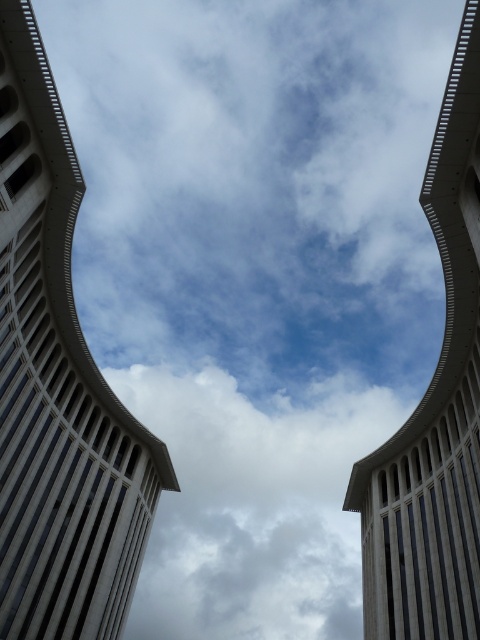
You are a drone operator tasked with flying a drone between the white fluffy cloud at center and the gray concrete tower at center. The drone has a maximum flight distance of 200 meters. Can the drone safely fly between them without exceeding its range?

The white fluffy cloud at center and gray concrete tower at center are 194.34 meters apart from each other. Since the drone has a maximum flight distance of 200 meters, it can safely fly between them without exceeding its range.